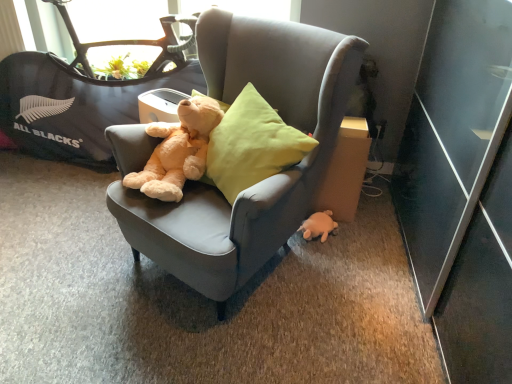
Question: Considering the relative sizes of light brown plush teddy bear at center and cardboard at right in the image provided, is light brown plush teddy bear at center thinner than cardboard at right?

Choices:
 (A) yes
 (B) no

Answer: (B)

Question: Is light brown plush teddy bear at center taller than cardboard at right?

Choices:
 (A) yes
 (B) no

Answer: (B)

Question: From a real-world perspective, is light brown plush teddy bear at center on top of cardboard at right?

Choices:
 (A) no
 (B) yes

Answer: (B)

Question: Is light brown plush teddy bear at center bigger than cardboard at right?

Choices:
 (A) yes
 (B) no

Answer: (A)

Question: Is light brown plush teddy bear at center directly adjacent to cardboard at right?

Choices:
 (A) yes
 (B) no

Answer: (B)

Question: Looking at their shapes, would you say black fabric baby carriage at upper left is wider or thinner than velvet gray chair at center?

Choices:
 (A) thin
 (B) wide

Answer: (A)

Question: Considering the relative positions of black fabric baby carriage at upper left and velvet gray chair at center in the image provided, is black fabric baby carriage at upper left to the left or to the right of velvet gray chair at center?

Choices:
 (A) right
 (B) left

Answer: (B)

Question: From the image's perspective, is black fabric baby carriage at upper left above or below velvet gray chair at center?

Choices:
 (A) below
 (B) above

Answer: (B)

Question: Considering the positions of point (32, 117) and point (266, 226), is point (32, 117) closer or farther from the camera than point (266, 226)?

Choices:
 (A) farther
 (B) closer

Answer: (A)

Question: Looking at the image, does black fabric baby carriage at upper left seem bigger or smaller compared to cardboard at right?

Choices:
 (A) small
 (B) big

Answer: (B)

Question: From the image's perspective, is black fabric baby carriage at upper left positioned above or below cardboard at right?

Choices:
 (A) below
 (B) above

Answer: (B)

Question: Based on their positions, is black fabric baby carriage at upper left located to the left or right of cardboard at right?

Choices:
 (A) right
 (B) left

Answer: (B)

Question: Looking at their shapes, would you say black fabric baby carriage at upper left is wider or thinner than cardboard at right?

Choices:
 (A) thin
 (B) wide

Answer: (B)

Question: From a real-world perspective, is white plush turtle at lower right above or below velvet gray chair at center?

Choices:
 (A) above
 (B) below

Answer: (B)

Question: Would you say white plush turtle at lower right is to the left or to the right of velvet gray chair at center in the picture?

Choices:
 (A) left
 (B) right

Answer: (B)